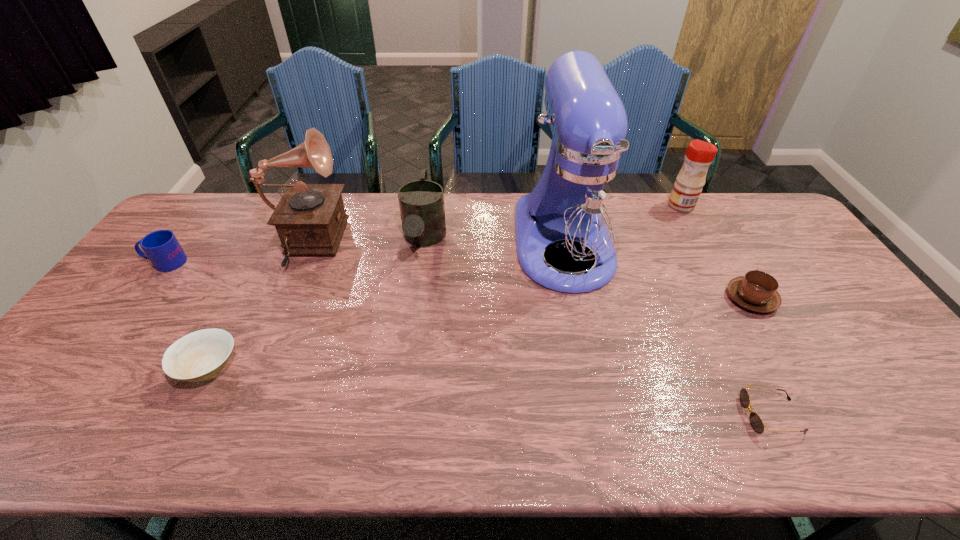
Locate an element on the screen. Image resolution: width=960 pixels, height=540 pixels. sunglasses is located at coordinates (756, 423).

Locate an element on the screen. This screenshot has width=960, height=540. free location located 0.310m at the mixing area of the mixer is located at coordinates (598, 405).

Where is `blank space located 0.250m on the horn of the seventh shortest object`? The image size is (960, 540). blank space located 0.250m on the horn of the seventh shortest object is located at coordinates (422, 247).

Locate an element on the screen. This screenshot has width=960, height=540. vacant space located on the front of the condiment is located at coordinates (702, 242).

The width and height of the screenshot is (960, 540). What are the coordinates of `free point located with the spout on the watering can` in the screenshot? It's located at (411, 331).

Find the location of a particular element. free region located 0.090m on the side of the cappuccino with the handle is located at coordinates (729, 261).

Locate an element on the screen. Image resolution: width=960 pixels, height=540 pixels. vacant space located 0.130m on the side of the cappuccino with the handle is located at coordinates [x=724, y=253].

This screenshot has height=540, width=960. I want to click on vacant area situated 0.390m on the side of the cappuccino with the handle, so coord(695,205).

Find the location of a particular element. vacant area situated 0.080m on the back of the bowl is located at coordinates (234, 319).

The image size is (960, 540). In order to click on free location located on the front-facing side of the sunglasses in this screenshot , I will do `click(603, 415)`.